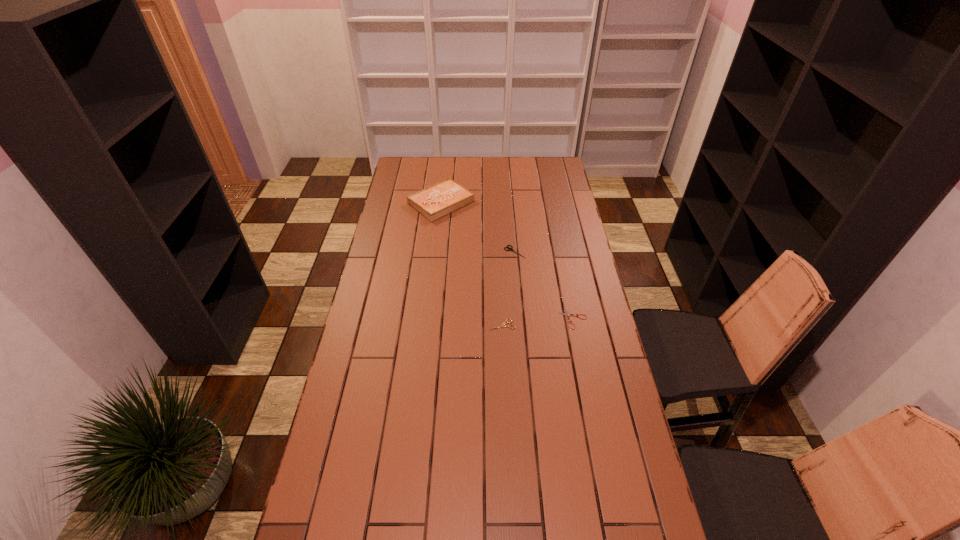
At what (x,y) coordinates should I click in order to perform the action: click on the tallest object. Please return your answer as a coordinate pair (x, y). The image size is (960, 540). Looking at the image, I should click on pyautogui.click(x=438, y=200).

The image size is (960, 540). I want to click on the farthest object, so click(438, 200).

Image resolution: width=960 pixels, height=540 pixels. In order to click on the third nearest object in this screenshot , I will do `click(509, 249)`.

I want to click on the farthest shears, so click(x=509, y=249).

At what (x,y) coordinates should I click in order to perform the action: click on the second shortest object. Please return your answer as a coordinate pair (x, y). The height and width of the screenshot is (540, 960). Looking at the image, I should click on (504, 323).

At what (x,y) coordinates should I click in order to perform the action: click on the rightmost object. Please return your answer as a coordinate pair (x, y). Image resolution: width=960 pixels, height=540 pixels. Looking at the image, I should click on (567, 314).

Find the location of a particular element. Image resolution: width=960 pixels, height=540 pixels. the shortest object is located at coordinates (567, 314).

You are a GUI agent. You are given a task and a screenshot of the screen. Output one action in this format:
    pyautogui.click(x=<x>, y=<y>)
    Task: Click on the free space located on the front of the farthest object
    The width and height of the screenshot is (960, 540).
    Given the screenshot: What is the action you would take?
    pyautogui.click(x=434, y=271)

Locate an element on the screen. Image resolution: width=960 pixels, height=540 pixels. free space located on the back of the second tallest object is located at coordinates (514, 238).

At what (x,y) coordinates should I click in order to perform the action: click on vacant area situated 0.380m on the front of the second shortest shears. Please return your answer as a coordinate pair (x, y). The width and height of the screenshot is (960, 540). Looking at the image, I should click on (507, 429).